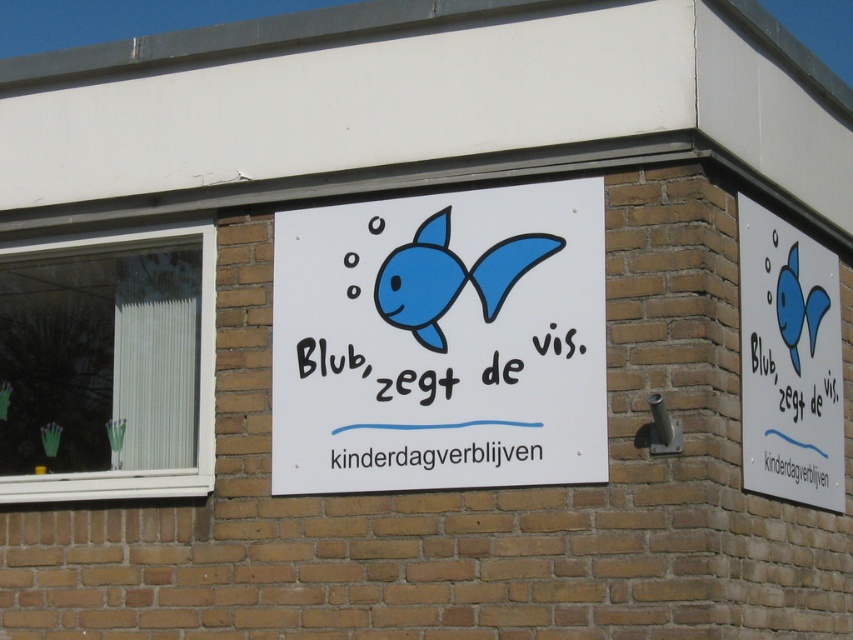
You are a delivery person trying to locate the entrance to the childcare center. You see the white paper sign at center and the matte blue fish at center. According to the scene description, which object is positioned to the left of the other?

The white paper sign at center is to the left of matte blue fish at center.

You are standing in front of the building and notice a white paper sign at center. Can you determine whether the white paper sign at center is located to the left or right of the point with coordinates (440,340)?

The white paper sign at center is located exactly at the point with coordinates (440,340).

You are a parent looking for the childcare center and see the white paper sign at center and the blue matte fish at upper right. Which object should you look at first to find the location of the childcare center?

The white paper sign at center is to the left of the blue matte fish at upper right, so you should look at the white paper sign at center first since it is positioned to the left, which is typically where text is read first in many languages.